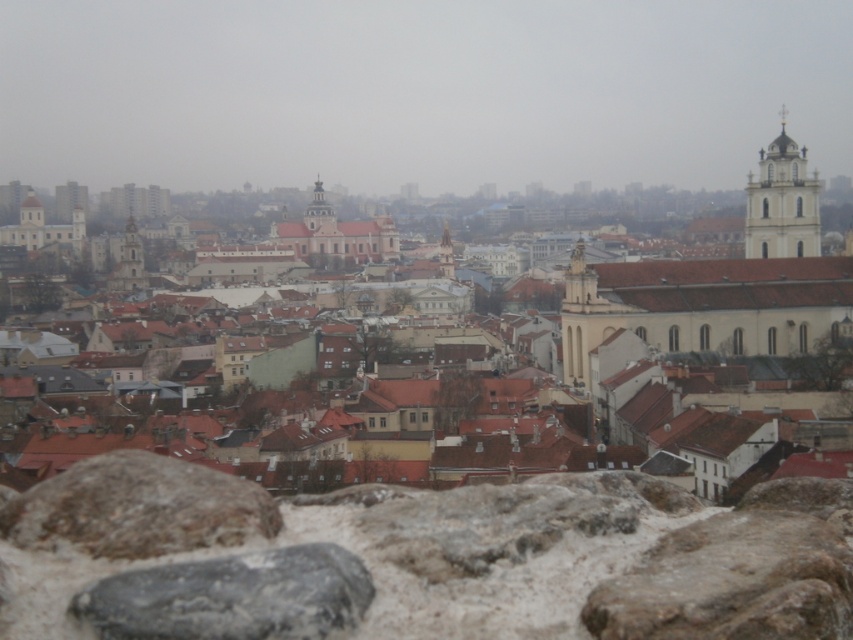
Question: Based on their relative distances, which object is farther from the gray rough stone at lower left?

Choices:
 (A) gray rough stone at center
 (B) smooth stone tower at center

Answer: (B)

Question: Among these points, which one is farthest from the camera?

Choices:
 (A) (695, 592)
 (B) (271, 576)

Answer: (B)

Question: Is gray rough stone at lower left positioned before smooth stone tower at center?

Choices:
 (A) no
 (B) yes

Answer: (B)

Question: Where is gray rough stone at center located in relation to smooth stone tower at center in the image?

Choices:
 (A) right
 (B) left

Answer: (B)

Question: Does smooth gray rock at center appear on the right side of white smooth tower at upper right?

Choices:
 (A) yes
 (B) no

Answer: (B)

Question: Which is nearer to the gray rough stone at lower left?

Choices:
 (A) brown tiled roofs at center
 (B) white smooth tower at upper right
 (C) gray rough stone at center

Answer: (C)